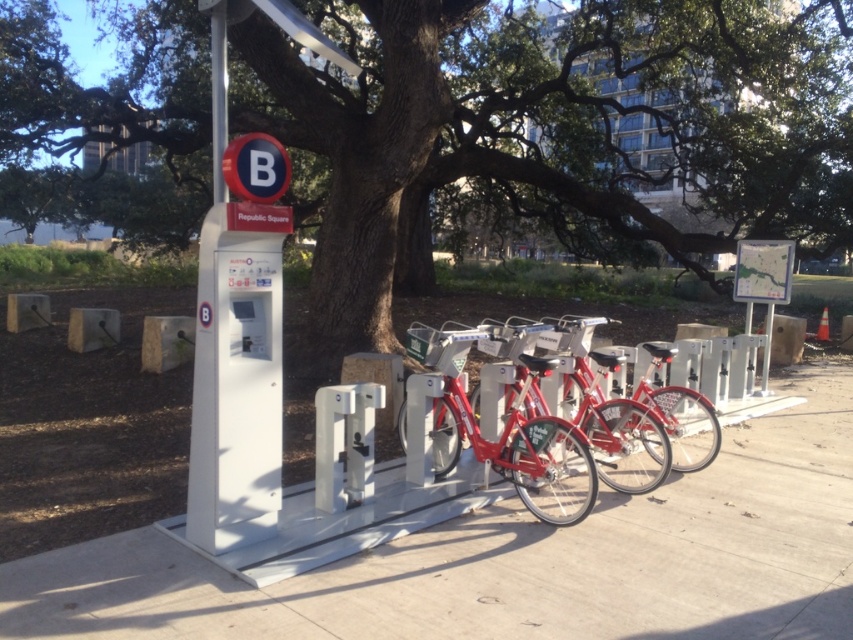
You are a city planner analyzing the bike station layout. Considering the green leafy tree at center and the metallic circular sign at upper center, which object is wider from your viewpoint?

The green leafy tree at center is wider than the metallic circular sign at upper center according to the description.

You are standing at the bike station and want to take a photo of the shiny metallic bicycle at center. However, the green leafy tree at center is blocking your view. Can you move to the left or right to get a clear shot without the tree in the frame?

The green leafy tree at center is above the shiny metallic bicycle at center, so moving to the left or right might allow you to position yourself where the tree branches or leaves are not obstructing the bicycle. However, since both are at the center, you may need to adjust your angle slightly to the side to avoid the tree coverage above the bicycle.

You are at the bike station and need to locate two specific points marked on the map. The first point is at coordinate point(779, 211) and the second is at point(630, 451). From your current position, which point is closer to you?

Point(630, 451) is closer to you because it is in front of point(779, 211).